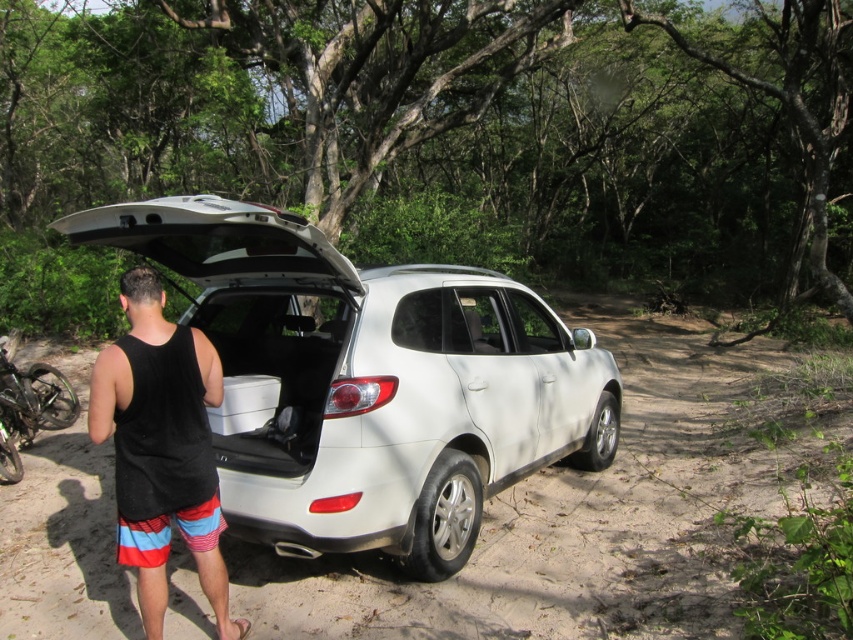
Between dirt track at center and black fabric tank top at center, which one is positioned higher?

black fabric tank top at center is higher up.

Looking at this image, is dirt track at center further to camera compared to black fabric tank top at center?

Yes.

What do you see at coordinates (572, 520) in the screenshot? I see `dirt track at center` at bounding box center [572, 520].

Where is `dirt track at center`? Image resolution: width=853 pixels, height=640 pixels. dirt track at center is located at coordinates (572, 520).

Is white matte suv at center to the left of dirt track at center from the viewer's perspective?

Indeed, white matte suv at center is positioned on the left side of dirt track at center.

Does white matte suv at center come behind dirt track at center?

That is True.

Is point (428, 563) positioned before point (698, 628)?

No, (428, 563) is behind (698, 628).

I want to click on white matte suv at center, so click(x=367, y=381).

Does point (402, 528) come farther from viewer compared to point (157, 342)?

Yes, it is behind point (157, 342).

Who is more forward, (354, 305) or (228, 618)?

Point (228, 618)

Where is `white matte suv at center`? Image resolution: width=853 pixels, height=640 pixels. white matte suv at center is located at coordinates (367, 381).